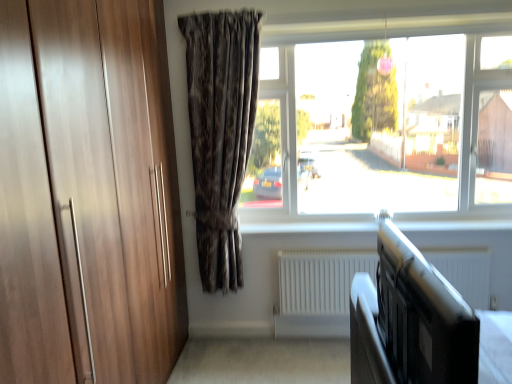
I want to click on free space above white matte radiator at lower center (from a real-world perspective), so coord(375,253).